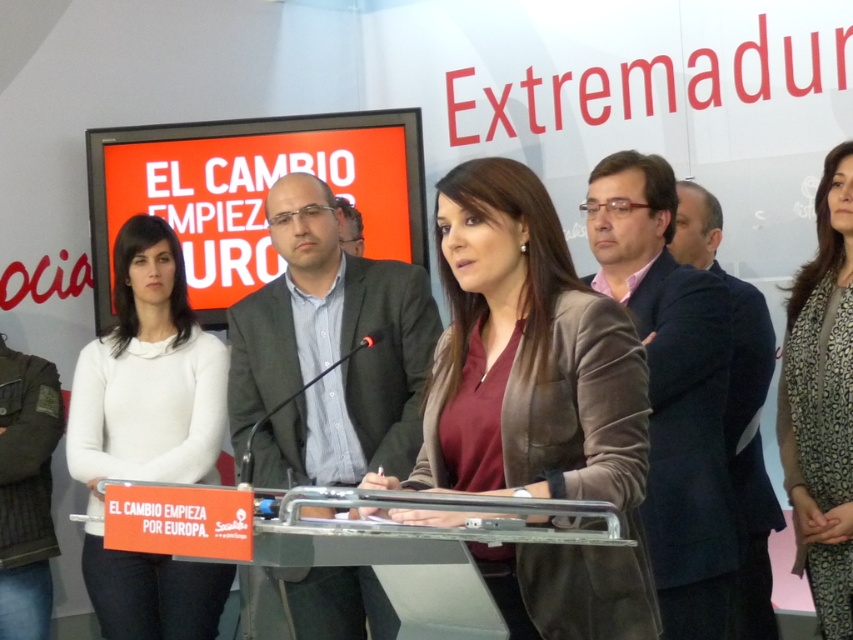
You are attending the press conference and notice the brown leather jacket at center. Where exactly is it positioned in relation to the podium and the large screen?

The brown leather jacket at center is located at point coordinates of 0.633 on the x and 0.628 on the y axis, which places it centrally positioned in the scene between the podium and the large screen.

A man is standing 1.7 meters tall. He wants to reach the brown leather jacket at center from his current position. Can he do so without moving?

The brown leather jacket at center is 1.83 meters away from the man, so he cannot reach it without moving since the distance is greater than his height.